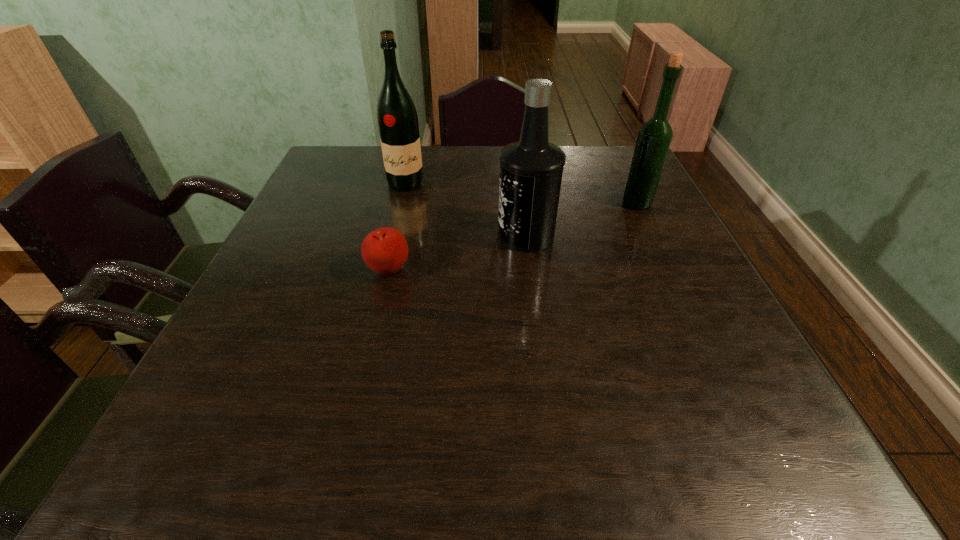
At what (x,y) coordinates should I click in order to perform the action: click on object that is the nearest to the third farthest object. Please return your answer as a coordinate pair (x, y). The width and height of the screenshot is (960, 540). Looking at the image, I should click on (385, 250).

You are a GUI agent. You are given a task and a screenshot of the screen. Output one action in this format:
    pyautogui.click(x=<x>, y=<y>)
    Task: Click on the liquor that is the second closest to the farthest liquor
    
    Given the screenshot: What is the action you would take?
    pyautogui.click(x=654, y=137)

Point out which liquor is positioned as the second nearest to the apple. Please provide its 2D coordinates. Your answer should be formatted as a tuple, i.e. [(x, y)], where the tuple contains the x and y coordinates of a point satisfying the conditions above.

[(397, 118)]

Where is `free spot that satisfies the following two spatial constraints: 1. on the front-facing side of the nearest object; 2. on the right side of the farthest object`? The width and height of the screenshot is (960, 540). free spot that satisfies the following two spatial constraints: 1. on the front-facing side of the nearest object; 2. on the right side of the farthest object is located at coordinates (384, 271).

The width and height of the screenshot is (960, 540). Identify the location of vacant point that satisfies the following two spatial constraints: 1. on the front-facing side of the leftmost liquor; 2. on the right side of the second farthest liquor. (401, 203).

The image size is (960, 540). What are the coordinates of `vacant space that satisfies the following two spatial constraints: 1. on the front-facing side of the apple; 2. on the right side of the farthest object` in the screenshot? It's located at (384, 271).

Identify the location of free point that satisfies the following two spatial constraints: 1. on the front-facing side of the farthest liquor; 2. on the right side of the apple. The height and width of the screenshot is (540, 960). (384, 271).

The width and height of the screenshot is (960, 540). What are the coordinates of `free location that satisfies the following two spatial constraints: 1. on the front-facing side of the second farthest object; 2. on the left side of the leftmost liquor` in the screenshot? It's located at (401, 203).

Image resolution: width=960 pixels, height=540 pixels. Identify the location of vacant area in the image that satisfies the following two spatial constraints: 1. on the front-facing side of the apple; 2. on the right side of the farthest liquor. (384, 271).